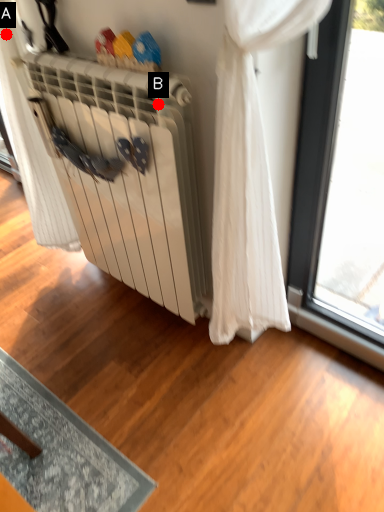
Question: Two points are circled on the image, labeled by A and B beside each circle. Which of the following is the farthest from the observer?

Choices:
 (A) A is further
 (B) B is further

Answer: (A)